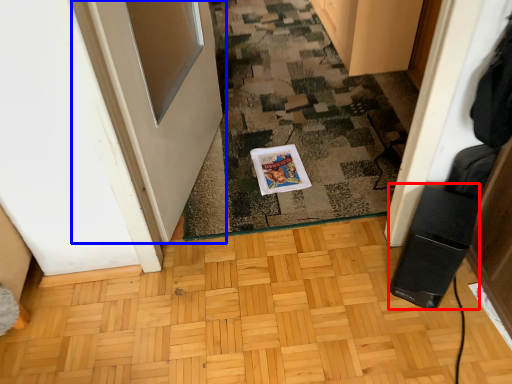
Question: Among these objects, which one is nearest to the camera, appliance (highlighted by a red box) or door (highlighted by a blue box)?

Choices:
 (A) appliance
 (B) door

Answer: (B)